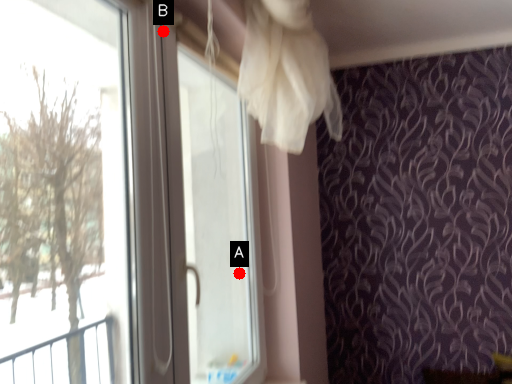
Question: Two points are circled on the image, labeled by A and B beside each circle. Among these points, which one is nearest to the camera?

Choices:
 (A) A is closer
 (B) B is closer

Answer: (B)